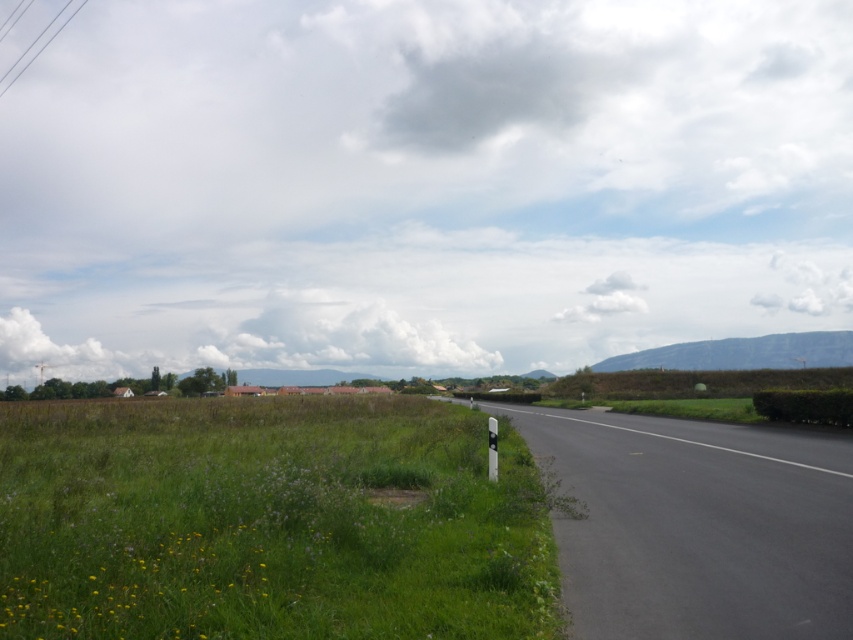
Does black asphalt road at center come behind white plastic sign at right?

No, it is in front of white plastic sign at right.

Is point (566, 433) positioned before point (490, 449)?

No, it is not.

Which is in front, point (668, 509) or point (497, 458)?

Positioned in front is point (668, 509).

Identify the location of black asphalt road at center. This screenshot has height=640, width=853. (697, 525).

How far apart are green grass at lower left and white plastic sign at right?

green grass at lower left is 11.61 meters away from white plastic sign at right.

Is point (421, 515) positioned in front of point (494, 467)?

Yes, it is in front of point (494, 467).

Where is `green grass at lower left`? Image resolution: width=853 pixels, height=640 pixels. green grass at lower left is located at coordinates (268, 522).

Based on the photo, is green grass at lower left above black asphalt road at center?

No, green grass at lower left is not above black asphalt road at center.

Is point (183, 570) positioned after point (724, 520)?

No.

I want to click on green grass at lower left, so click(x=268, y=522).

The image size is (853, 640). In order to click on green grass at lower left in this screenshot , I will do `click(268, 522)`.